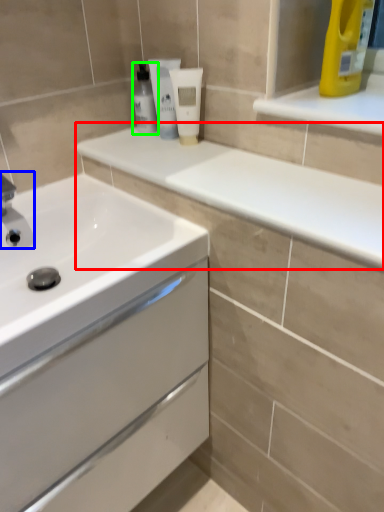
Question: Which object is positioned closest to counter top (highlighted by a red box)? Select from plumbing fixture (highlighted by a blue box) and mouthwash (highlighted by a green box).

Choices:
 (A) plumbing fixture
 (B) mouthwash

Answer: (B)